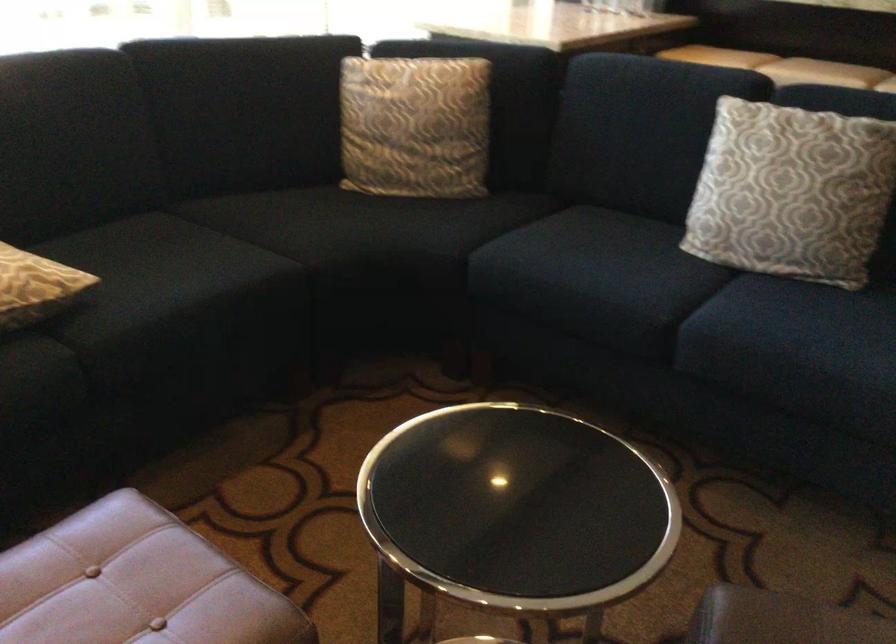
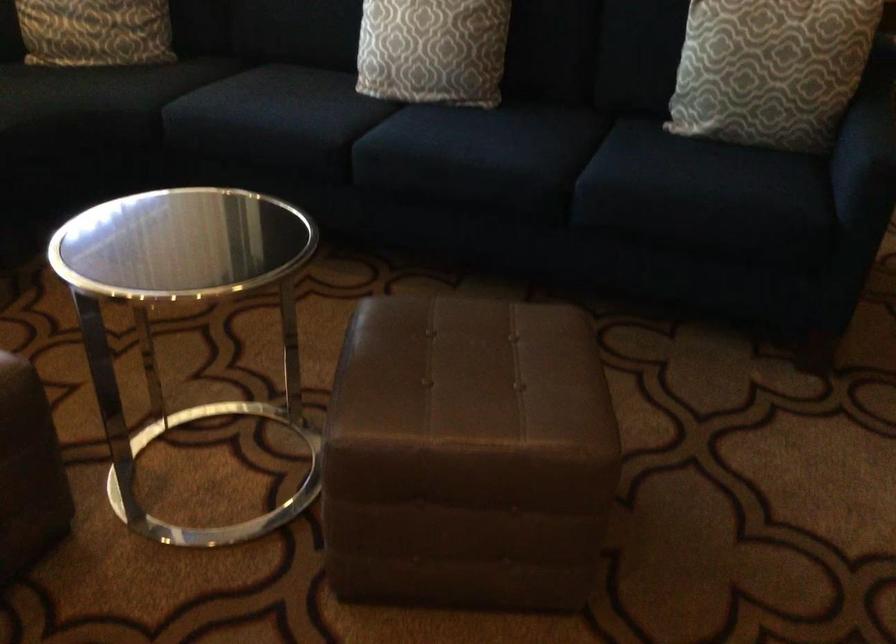
Question: Which direction would the cameraman need to move to produce the second image? Reply with the corresponding letter.

Choices:
 (A) Left
 (B) Right
 (C) Forward
 (D) Backward

Answer: (D)